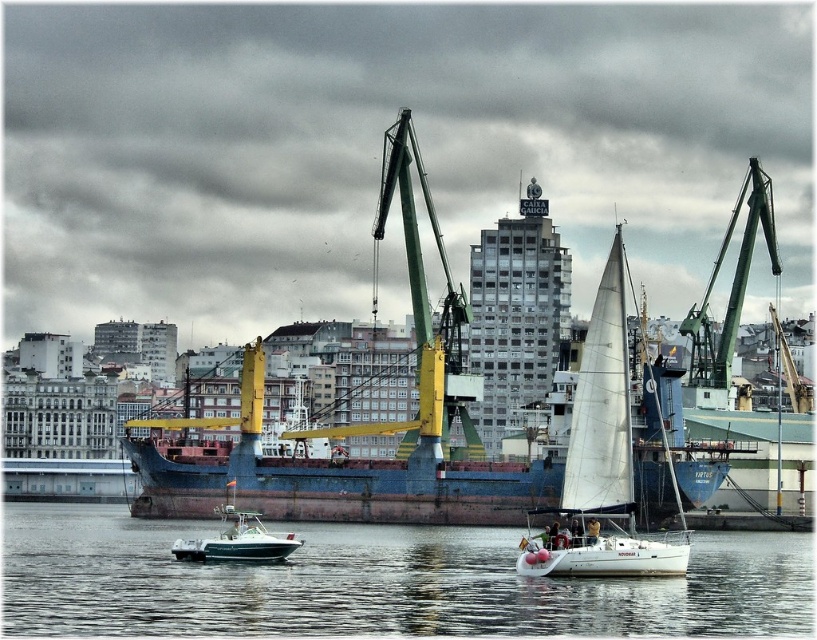
Between point (400, 449) and point (300, 541), which one is positioned behind?

Point (400, 449)

Can you confirm if green/yellow metal crane at center is positioned below green plastic motorboat at lower center?

Actually, green/yellow metal crane at center is above green plastic motorboat at lower center.

Identify the location of green/yellow metal crane at center. (418, 250).

Which of these two, clear water at lower center or white sailboat at center, stands taller?

With more height is white sailboat at center.

Can you confirm if clear water at lower center is bigger than white sailboat at center?

Yes, clear water at lower center is bigger than white sailboat at center.

Which is behind, point (438, 621) or point (688, 532)?

The point (688, 532) is behind.

The height and width of the screenshot is (640, 817). I want to click on clear water at lower center, so click(376, 582).

Does point (605, 500) come behind point (239, 529)?

Yes.

The image size is (817, 640). Find the location of `white sailboat at center`. white sailboat at center is located at coordinates (601, 461).

Who is more forward, (560, 509) or (284, 538)?

Point (284, 538)

Locate an element on the screen. The height and width of the screenshot is (640, 817). white sailboat at center is located at coordinates (601, 461).